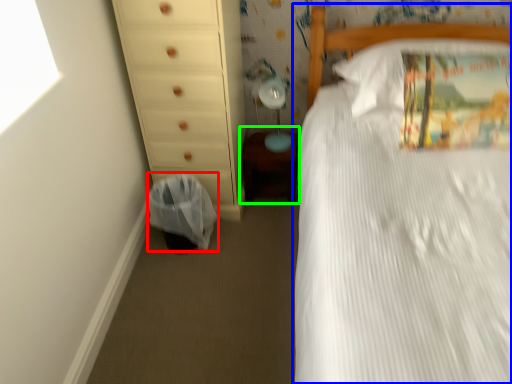
Question: Which object is the closest to the laundry basket (highlighted by a red box)? Choose among these: bed (highlighted by a blue box) or changing table (highlighted by a green box).

Choices:
 (A) bed
 (B) changing table

Answer: (B)